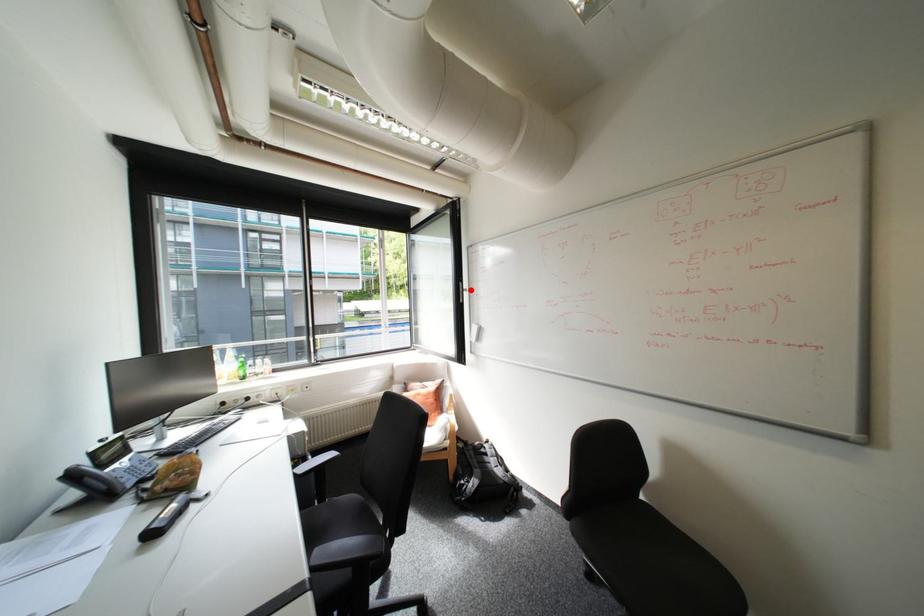
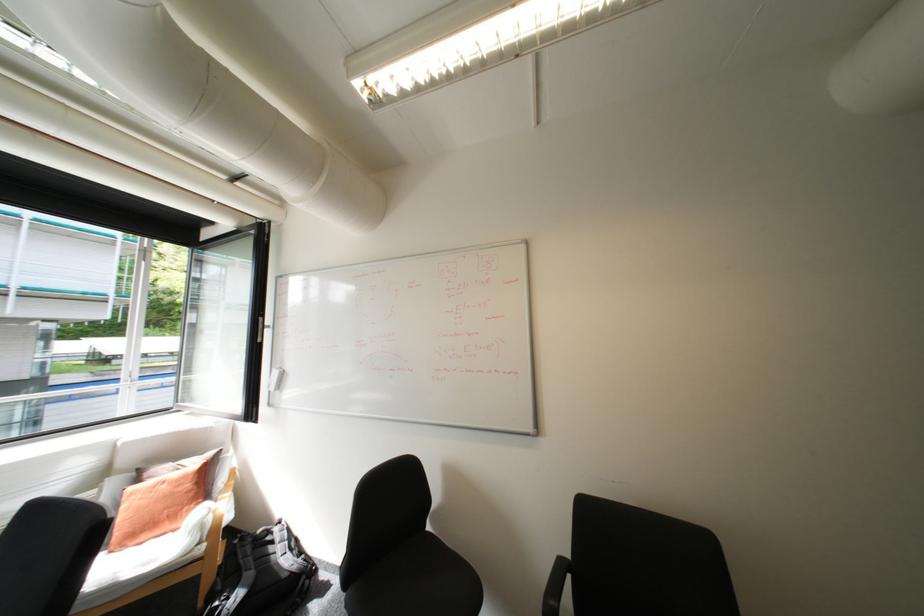
In the second image, find the point that corresponds to the highlighted location in the first image.

(271, 326)